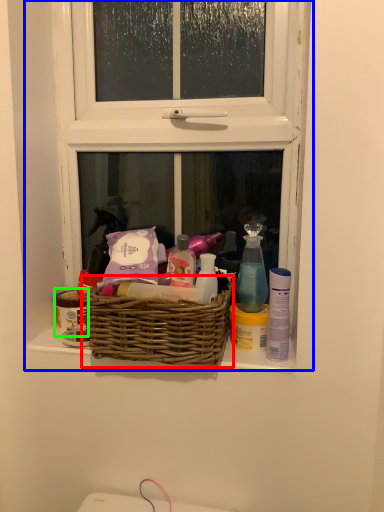
Question: Which is farther away from picnic basket (highlighted by a red box)? window (highlighted by a blue box) or toiletry (highlighted by a green box)?

Choices:
 (A) window
 (B) toiletry

Answer: (A)